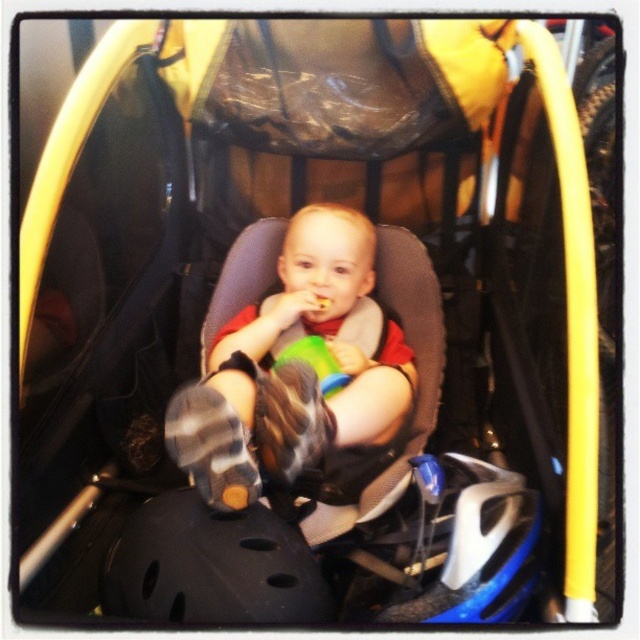
Question: Does matte gray baby at center appear under black matte bicycle helmet at lower center?

Choices:
 (A) no
 (B) yes

Answer: (A)

Question: Does matte gray baby at center appear on the right side of black matte bicycle helmet at lower center?

Choices:
 (A) yes
 (B) no

Answer: (A)

Question: Which object is farther from the camera taking this photo?

Choices:
 (A) matte gray baby at center
 (B) black matte bicycle helmet at lower center

Answer: (A)

Question: Can you confirm if matte gray baby at center is positioned above black matte bicycle helmet at lower center?

Choices:
 (A) no
 (B) yes

Answer: (B)